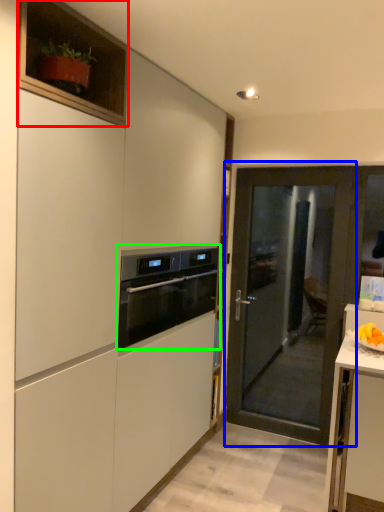
Question: Which object is the farthest from cabinetry (highlighted by a red box)? Choose among these: door (highlighted by a blue box) or kitchen appliance (highlighted by a green box).

Choices:
 (A) door
 (B) kitchen appliance

Answer: (A)